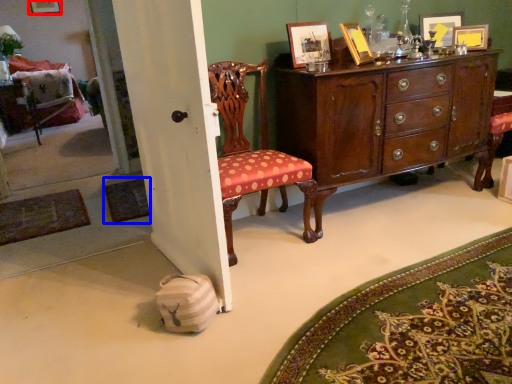
Question: Which point is further to the camera, picture frame (highlighted by a red box) or mat (highlighted by a blue box)?

Choices:
 (A) picture frame
 (B) mat

Answer: (A)